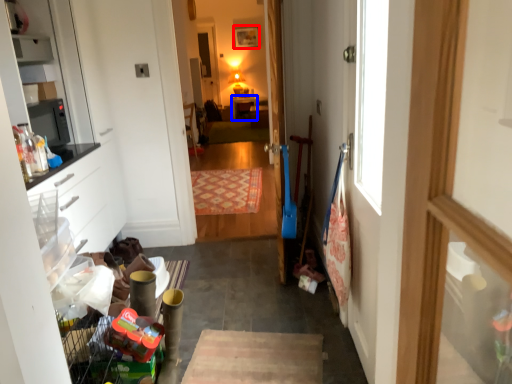
Question: Among these objects, which one is nearest to the camera, picture frame (highlighted by a red box) or table (highlighted by a blue box)?

Choices:
 (A) picture frame
 (B) table

Answer: (B)